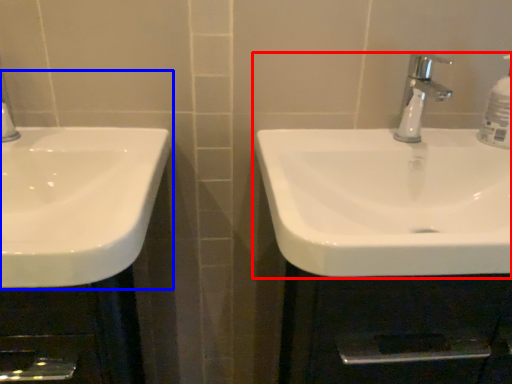
Question: Which of the following is the farthest to the observer, sink (highlighted by a red box) or sink (highlighted by a blue box)?

Choices:
 (A) sink
 (B) sink

Answer: (A)